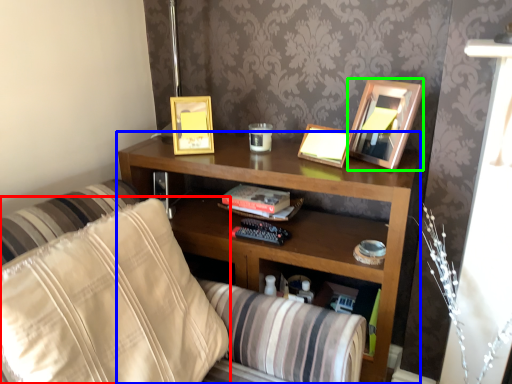
Question: Which object is positioned farthest from pillow (highlighted by a red box)? Select from shelf (highlighted by a blue box) and picture frame (highlighted by a green box).

Choices:
 (A) shelf
 (B) picture frame

Answer: (B)